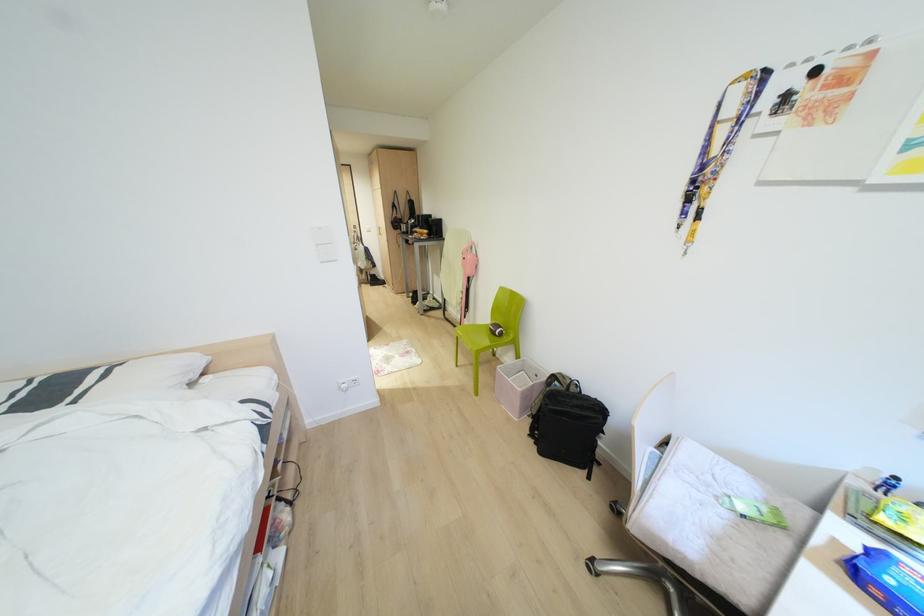
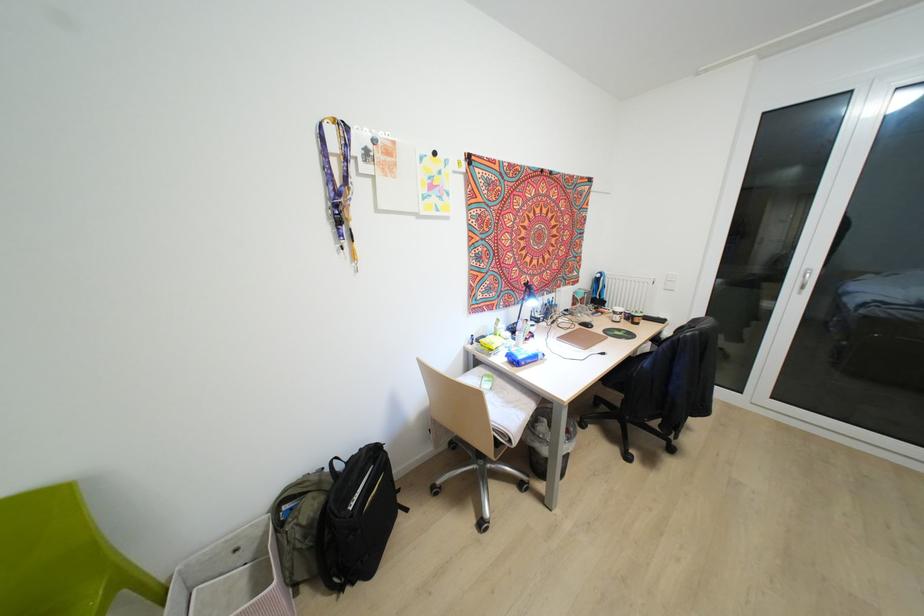
Find the pixel in the second image that matches point 555,382 in the first image.

(285, 507)